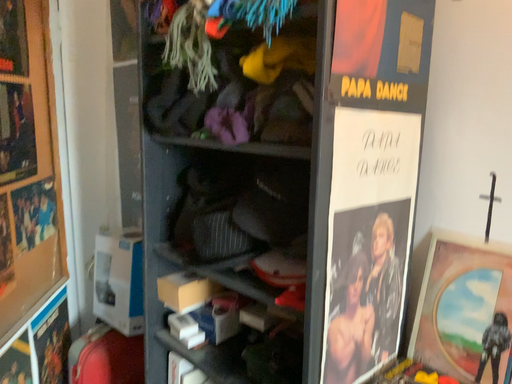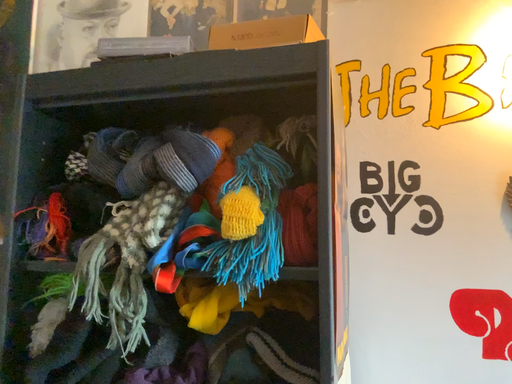
Question: How did the camera likely rotate when shooting the video?

Choices:
 (A) rotated downward
 (B) rotated upward

Answer: (B)